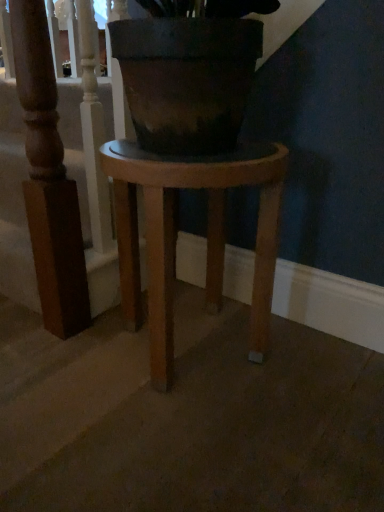
What do you see at coordinates (60, 173) in the screenshot? This screenshot has height=512, width=384. I see `wooden baluster at upper left` at bounding box center [60, 173].

The width and height of the screenshot is (384, 512). Find the location of `wooden baluster at upper left`. wooden baluster at upper left is located at coordinates (60, 173).

What do you see at coordinates (177, 231) in the screenshot? The image size is (384, 512). I see `wooden stool at center` at bounding box center [177, 231].

What is the approximate width of wooden stool at center?

It is 15.34 inches.

Find the location of a particular element. This screenshot has height=512, width=384. wooden stool at center is located at coordinates (177, 231).

Locate an element on the screen. This screenshot has height=512, width=384. wooden baluster at upper left is located at coordinates (60, 173).

Which object is positioned more to the left, wooden stool at center or wooden baluster at upper left?

wooden baluster at upper left is more to the left.

Which is behind, wooden stool at center or wooden baluster at upper left?

Positioned behind is wooden baluster at upper left.

Between point (132, 165) and point (46, 106), which one is positioned behind?

The point (46, 106) is farther from the camera.

From the image's perspective, is wooden stool at center on wooden baluster at upper left?

No, from the image's perspective, wooden stool at center is not above wooden baluster at upper left.

From a real-world perspective, is wooden stool at center positioned under wooden baluster at upper left based on gravity?

Yes, from a real-world perspective, wooden stool at center is below wooden baluster at upper left.

Considering the sizes of objects wooden stool at center and wooden baluster at upper left in the image provided, who is thinner, wooden stool at center or wooden baluster at upper left?

wooden baluster at upper left is thinner.

From their relative heights in the image, would you say wooden stool at center is taller or shorter than wooden baluster at upper left?

In the image, wooden stool at center appears to be shorter than wooden baluster at upper left.

Is wooden stool at center bigger than wooden baluster at upper left?

Yes, wooden stool at center is bigger than wooden baluster at upper left.

Would you say wooden stool at center contains wooden baluster at upper left?

No, wooden baluster at upper left is not surrounded by wooden stool at center.

Is the surface of wooden stool at center in direct contact with wooden baluster at upper left?

No, wooden stool at center is not beside wooden baluster at upper left.

In the scene shown: Could you tell me if wooden stool at center is facing wooden baluster at upper left?

No, wooden stool at center is not aimed at wooden baluster at upper left.

How different are the orientations of wooden stool at center and wooden baluster at upper left in degrees?

There is a 90.8-degree angle between the facing directions of wooden stool at center and wooden baluster at upper left.

Locate an element on the screen. rail on the left of wooden stool at center is located at coordinates (60, 173).

Considering the relative positions of wooden baluster at upper left and wooden stool at center in the image provided, is wooden baluster at upper left to the left or to the right of wooden stool at center?

wooden baluster at upper left is to the left of wooden stool at center.

Between wooden baluster at upper left and wooden stool at center, which one is positioned in front?

wooden stool at center is closer to the camera.

Considering the points (83, 325) and (191, 158), which point is in front, point (83, 325) or point (191, 158)?

The point (191, 158) is more forward.

Looking at this image, from the image's perspective, between wooden baluster at upper left and wooden stool at center, who is located below?

wooden stool at center, from the image's perspective.

From a real-world perspective, is wooden baluster at upper left above or below wooden stool at center?

wooden baluster at upper left is situated higher than wooden stool at center in the real world.

From the picture: In terms of width, does wooden baluster at upper left look wider or thinner when compared to wooden stool at center?

Clearly, wooden baluster at upper left has less width compared to wooden stool at center.

Which of these two, wooden baluster at upper left or wooden stool at center, stands taller?

Standing taller between the two is wooden baluster at upper left.

Is wooden baluster at upper left bigger than wooden stool at center?

Actually, wooden baluster at upper left might be smaller than wooden stool at center.

Is wooden baluster at upper left inside or outside of wooden stool at center?

wooden baluster at upper left is outside wooden stool at center.

Is wooden baluster at upper left placed right next to wooden stool at center?

No, wooden baluster at upper left is not in contact with wooden stool at center.

Is wooden baluster at upper left oriented away from wooden stool at center?

Yes, wooden baluster at upper left is positioned with its back facing wooden stool at center.

Measure the distance from wooden baluster at upper left to wooden stool at center.

A distance of 10.44 inches exists between wooden baluster at upper left and wooden stool at center.

You are a GUI agent. You are given a task and a screenshot of the screen. Output one action in this format:
    pyautogui.click(x=<x>, y=<y>)
    Task: Click on the rail above the wooden stool at center (from the image's perspective)
    
    Given the screenshot: What is the action you would take?
    pyautogui.click(x=60, y=173)

Locate an element on the screen. stool in front of the wooden baluster at upper left is located at coordinates (177, 231).

The image size is (384, 512). What are the coordinates of `rail behind the wooden stool at center` in the screenshot? It's located at (60, 173).